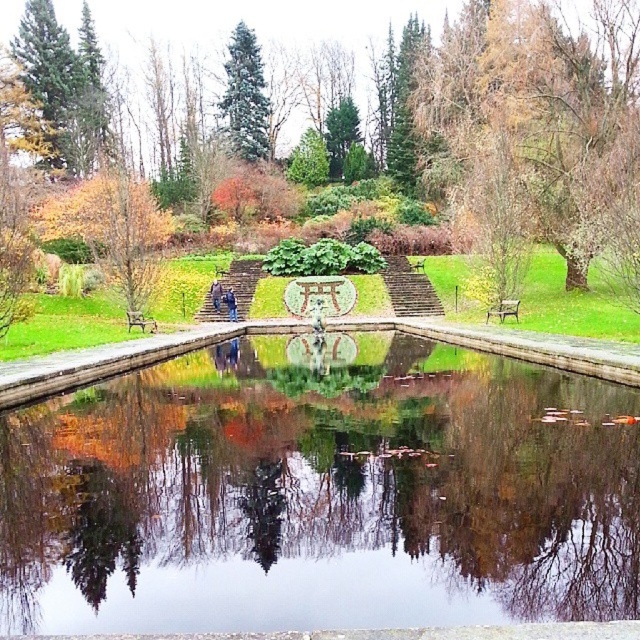
You are sitting on the green wooden bench at center and want to look at the brown textured tree at right. Can you see it clearly from your current position?

The brown textured tree at right is in front of the green wooden bench at center, so yes, you can see it clearly from your current position on the green wooden bench at center.

You are standing on the stone steps looking towards the pond. You see the transparent glass water at center and the green matte tree at upper center. Which object is closer to you?

The transparent glass water at center is closer to you because it is positioned under the green matte tree at upper center, meaning it is lower in the scene and thus nearer to your vantage point on the steps.